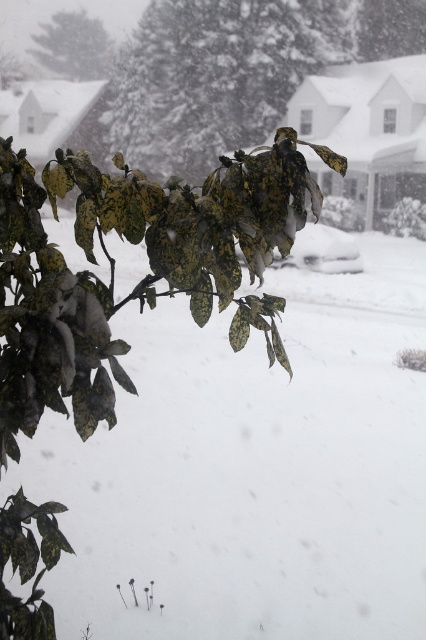
You are standing in the snowy winter scene and want to take a photo of both the green matte leaves at center and the green leafy branch at upper left. Which object should you focus on first if you want to capture both in the same frame without moving the camera?

You should focus on the green leafy branch at upper left first because it is positioned to the left of the green matte leaves at center, allowing both to be captured in the same frame without moving the camera.

You are a photographer trying to capture the green leafy branch at upper left and the green matte leaves at center in a single frame. Based on their positions, which object should you focus on first to ensure both are in the frame?

The green leafy branch at upper left should be focused on first since it is above the green matte leaves at center, allowing you to adjust the frame to include both.